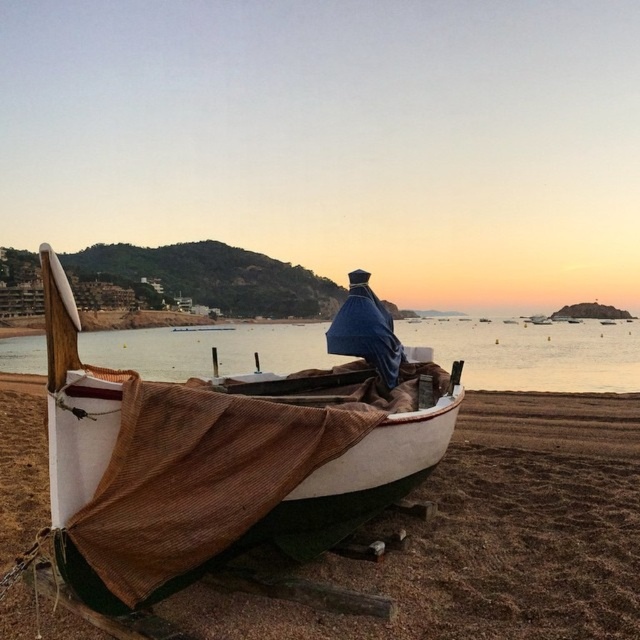
Which is more to the left, brown sand at lower center or matte brown water at center?

brown sand at lower center is more to the left.

Is point (592, 403) positioned behind point (266, 355)?

That is False.

I want to click on brown sand at lower center, so click(490, 538).

Is green canvas boat at center above matte brown water at center?

No, green canvas boat at center is not above matte brown water at center.

Which is in front, point (168, 424) or point (547, 332)?

Point (168, 424) is more forward.

Where is `green canvas boat at center`? Image resolution: width=640 pixels, height=640 pixels. green canvas boat at center is located at coordinates (220, 460).

Can you confirm if green canvas boat at center is shorter than brown sand at lower center?

No.

Is green canvas boat at center positioned behind brown sand at lower center?

No, green canvas boat at center is in front of brown sand at lower center.

What do you see at coordinates (220, 460) in the screenshot? I see `green canvas boat at center` at bounding box center [220, 460].

At what (x,y) coordinates should I click in order to perform the action: click on green canvas boat at center. Please return your answer as a coordinate pair (x, y). This screenshot has width=640, height=640. Looking at the image, I should click on (220, 460).